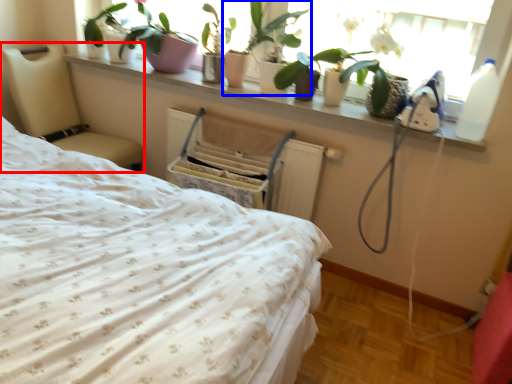
Question: Which point is further to the camera, furniture (highlighted by a red box) or houseplant (highlighted by a blue box)?

Choices:
 (A) furniture
 (B) houseplant

Answer: (A)